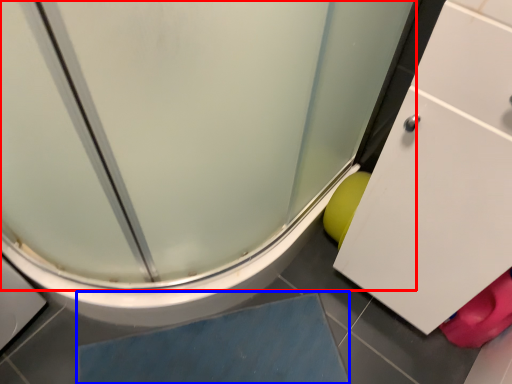
Question: Which point is further to the camera, screen door (highlighted by a red box) or slate (highlighted by a blue box)?

Choices:
 (A) screen door
 (B) slate

Answer: (B)